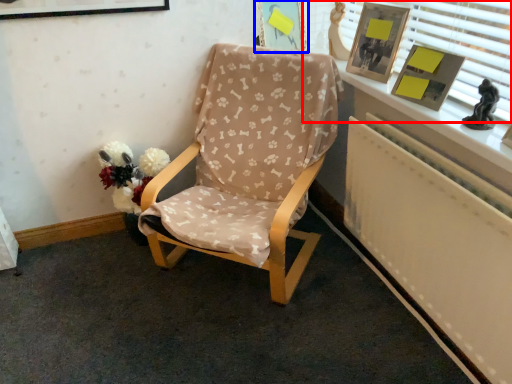
Question: Which of the following is the farthest to the observer, window frame (highlighted by a red box) or picture frame (highlighted by a blue box)?

Choices:
 (A) window frame
 (B) picture frame

Answer: (B)